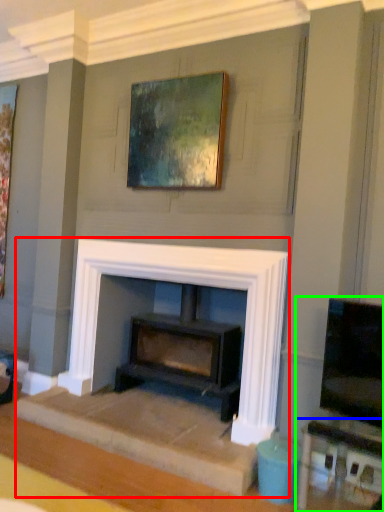
Question: Which object is positioned closest to fireplace (highlighted by a red box)? Select from table (highlighted by a blue box) and entertainment center (highlighted by a green box).

Choices:
 (A) table
 (B) entertainment center

Answer: (B)